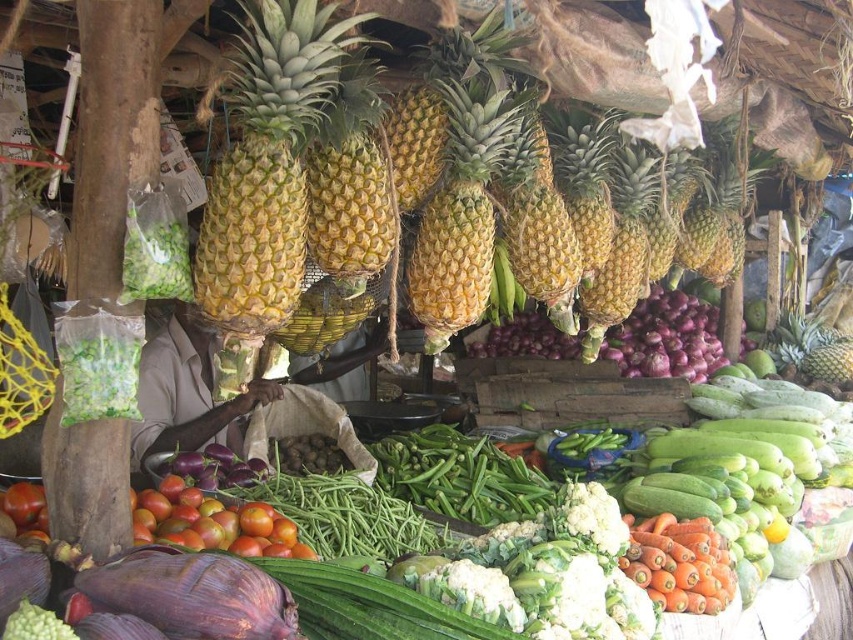
Question: Is yellow-green textured pineapple at center bigger than golden textured pineapple at center?

Choices:
 (A) no
 (B) yes

Answer: (B)

Question: Is yellow-green textured pineapple at center closer to camera compared to golden textured pineapple at center?

Choices:
 (A) no
 (B) yes

Answer: (B)

Question: Among these objects, which one is farthest from the camera?

Choices:
 (A) yellow-green textured pineapple at center
 (B) golden textured pineapple at center

Answer: (B)

Question: Among these objects, which one is farthest from the camera?

Choices:
 (A) golden textured pineapple at center
 (B) yellow-green textured pineapple at center

Answer: (A)

Question: Is yellow-green textured pineapple at center to the right of golden textured pineapple at center from the viewer's perspective?

Choices:
 (A) no
 (B) yes

Answer: (A)

Question: Which of the following is the closest to the observer?

Choices:
 (A) golden textured pineapple at center
 (B) yellow-green textured pineapple at center

Answer: (B)